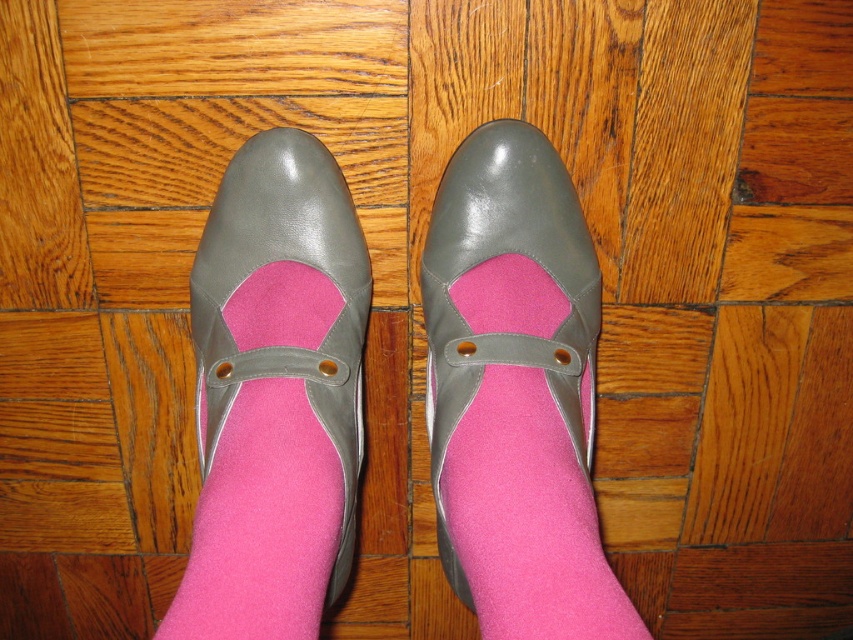
Between matte gray sandal at center and matte gray shoe at center, which one has more height?

matte gray sandal at center is taller.

Measure the distance between matte gray sandal at center and matte gray shoe at center.

matte gray sandal at center and matte gray shoe at center are 5.25 inches apart.

Where is `matte gray sandal at center`? matte gray sandal at center is located at coordinates (515, 392).